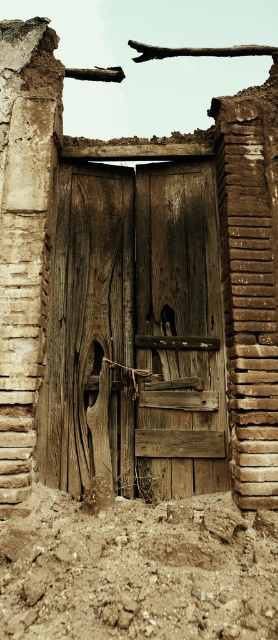
Question: Does weathered wood door at center appear on the right side of brown sandy soil at lower center?

Choices:
 (A) no
 (B) yes

Answer: (A)

Question: Can you confirm if weathered wood door at center is thinner than brown sandy soil at lower center?

Choices:
 (A) no
 (B) yes

Answer: (B)

Question: Can you confirm if weathered wood door at center is positioned to the right of brown sandy soil at lower center?

Choices:
 (A) no
 (B) yes

Answer: (A)